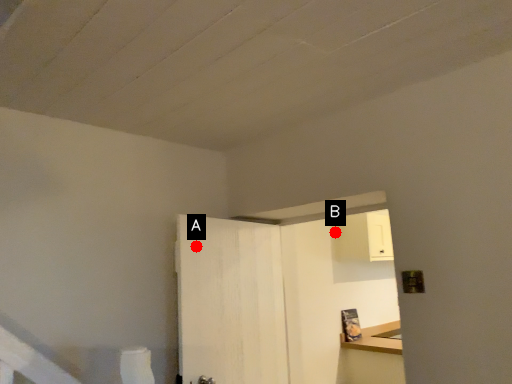
Question: Two points are circled on the image, labeled by A and B beside each circle. Which point appears closest to the camera in this image?

Choices:
 (A) A is closer
 (B) B is closer

Answer: (A)